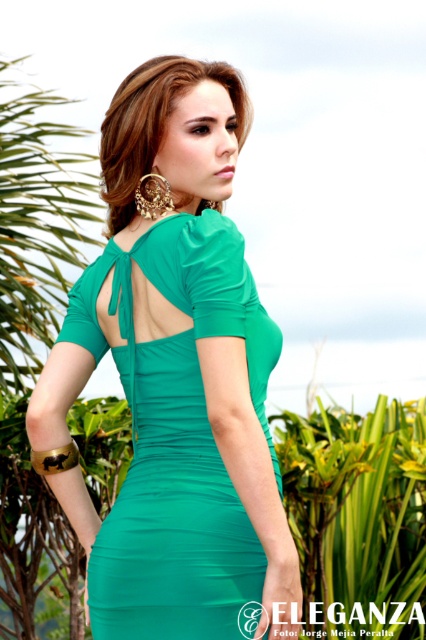
Question: Can you confirm if emerald green dress at center is positioned above shiny gold earrings at upper center?

Choices:
 (A) yes
 (B) no

Answer: (B)

Question: Which object appears closest to the camera in this image?

Choices:
 (A) shiny gold earrings at upper center
 (B) emerald green dress at center

Answer: (B)

Question: Considering the relative positions of emerald green dress at center and shiny gold earrings at upper center in the image provided, where is emerald green dress at center located with respect to shiny gold earrings at upper center?

Choices:
 (A) below
 (B) above

Answer: (A)

Question: Is emerald green dress at center above shiny gold earrings at upper center?

Choices:
 (A) yes
 (B) no

Answer: (B)